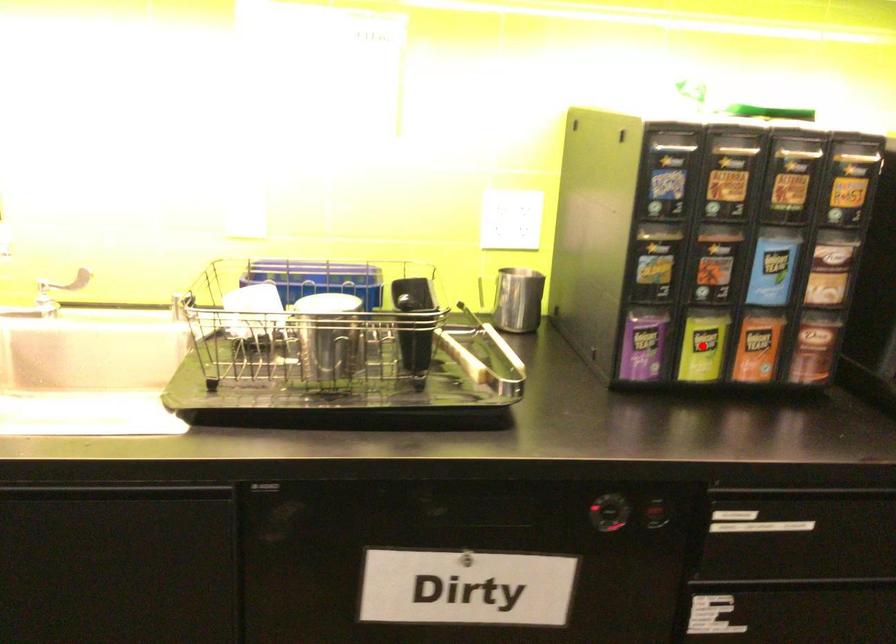
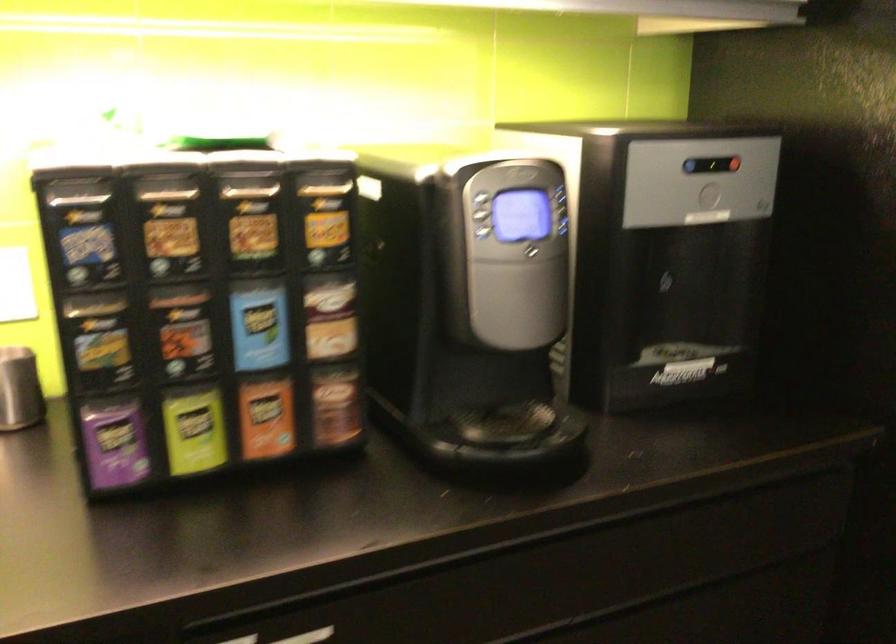
Locate, in the second image, the point that corresponds to the highlighted location in the first image.

(194, 430)